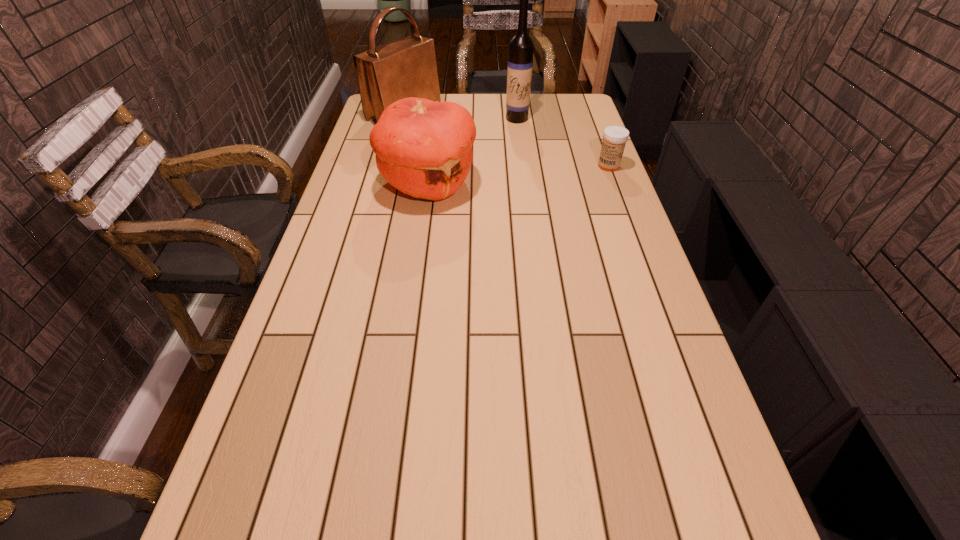
What are the coordinates of `pumpkin` in the screenshot? It's located at pos(423,148).

Identify the location of the rightmost object. (614, 137).

In order to click on medicine in this screenshot , I will do `click(614, 137)`.

Where is `wine bottle`? This screenshot has height=540, width=960. wine bottle is located at coordinates (520, 59).

Locate an element on the screen. the second tallest object is located at coordinates (403, 68).

Find the location of `vacant space located 0.050m on the front of the second shortest object`. vacant space located 0.050m on the front of the second shortest object is located at coordinates click(x=423, y=225).

Where is `vacant space situated 0.080m on the front of the medicine`? This screenshot has height=540, width=960. vacant space situated 0.080m on the front of the medicine is located at coordinates (616, 186).

Find the location of a particular element. vacant space located on the label of the third object from left to right is located at coordinates (501, 163).

Locate an element on the screen. The height and width of the screenshot is (540, 960). blank space located on the label of the third object from left to right is located at coordinates (507, 147).

The width and height of the screenshot is (960, 540). I want to click on vacant point located on the label of the third object from left to right, so click(x=501, y=163).